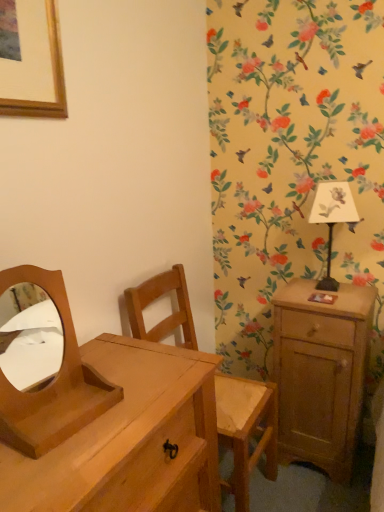
Locate an element on the screen. free spot below white paper lampshade at upper right (from a real-world perspective) is located at coordinates (323, 290).